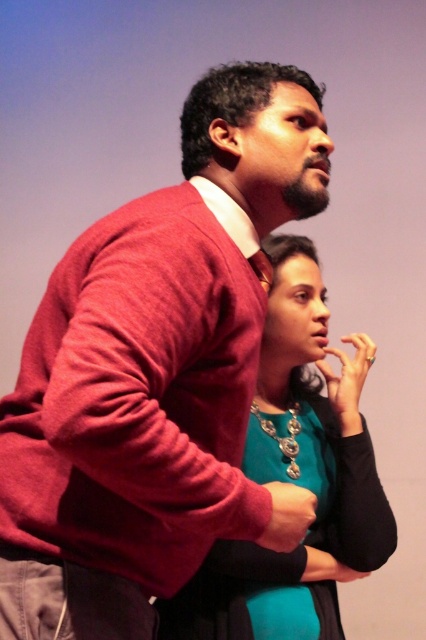
You are an artist trying to paint this scene. You need to decide the order of painting layers based on their positions. Which object should you paint first, the matte red sweater at upper left or the teal satin blouse at center, to ensure proper layering?

The matte red sweater at upper left should be painted first because it is taller than the teal satin blouse at center, meaning it is closer to the viewer and should be layered over the blouse.

You are trying to decide which item to place in a display case that can only accommodate items up to 1 meter in width. Given the information about the matte red sweater at upper left and the teal satin blouse at center, can you determine if either of them will fit in the case?

The matte red sweater at upper left might be wider than teal satin blouse at center. However, since the exact width of either item isn not provided, it is uncertain whether they will fit in the display case.